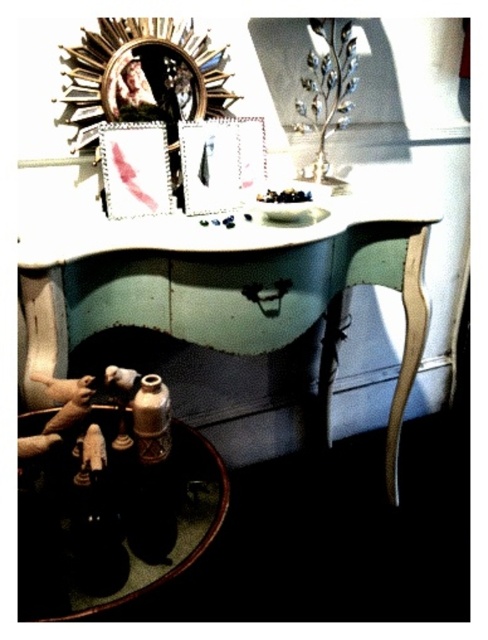
You are organizing items on the vanity table and need to place a new object between the shiny brown wood at lower left and the metallic silver picture frame at upper center. Is this possible given their positions?

The shiny brown wood at lower left is to the right of the metallic silver picture frame at upper center, so there is space between them to place a new object.

You are a photographer setting up a shot of the vanity table. You need to place a small prop that requires 50 centimeters of space in front of the shiny brown wood at lower left. Is there enough space?

The shiny brown wood at lower left is 60.80 centimeters away from the camera, so there is sufficient space to place the prop requiring 50 centimeters in front of it.

You are organizing items on the vanity table and want to place a new decoration between the shiny brown wood at lower left and the metallic silver picture frame at upper center. Based on their positions, where should you place it to ensure it sits between them?

The shiny brown wood at lower left is in front of the metallic silver picture frame at upper center, so placing the new decoration between them would require positioning it behind the shiny brown wood at lower left but in front of the metallic silver picture frame at upper center.